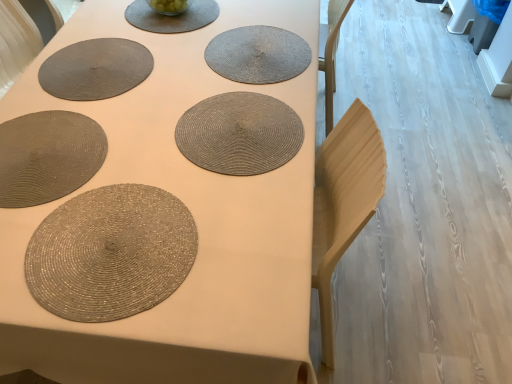
Where is `vacant region in front of rattan placemat at center, the second coaster positioned from the back`? vacant region in front of rattan placemat at center, the second coaster positioned from the back is located at coordinates (210, 215).